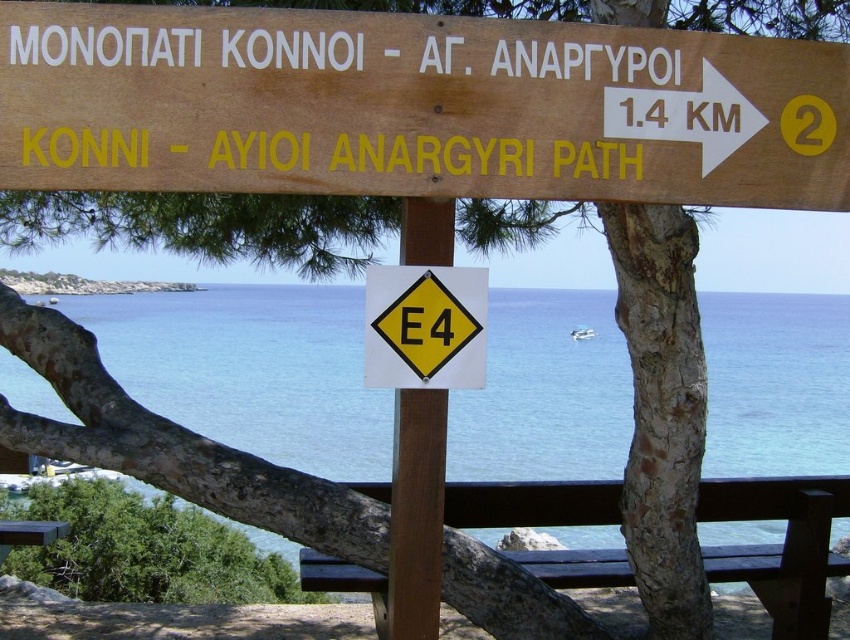
Question: Does yellow diamond sign at upper center have a smaller size compared to yellow plastic diamond at center?

Choices:
 (A) yes
 (B) no

Answer: (B)

Question: Does yellow diamond sign at upper center have a larger size compared to brown wooden bench at center?

Choices:
 (A) no
 (B) yes

Answer: (A)

Question: Does blue water at center have a larger size compared to green painted wood picnic table at lower left?

Choices:
 (A) yes
 (B) no

Answer: (A)

Question: Estimate the real-world distances between objects in this image. Which object is closer to the yellow diamond sign at upper center?

Choices:
 (A) yellow plastic diamond at center
 (B) brown wooden bench at center

Answer: (A)

Question: Which point appears farthest from the camera in this image?

Choices:
 (A) (3, 525)
 (B) (148, 326)
 (C) (374, 612)
 (D) (129, 156)

Answer: (B)

Question: Estimate the real-world distances between objects in this image. Which object is closer to the yellow diamond sign at upper center?

Choices:
 (A) green painted wood picnic table at lower left
 (B) brown wooden bench at center
 (C) blue water at center
 (D) yellow plastic diamond at center

Answer: (D)